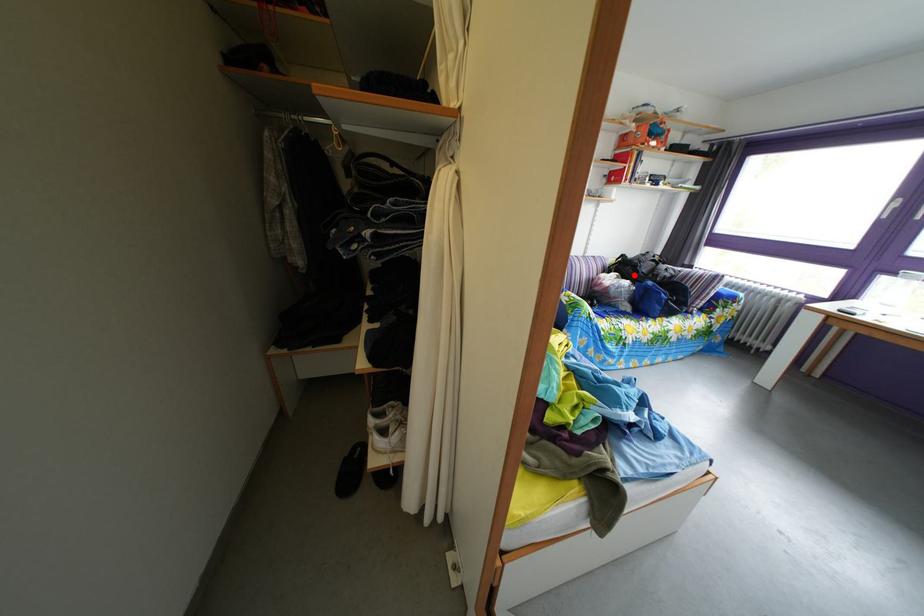
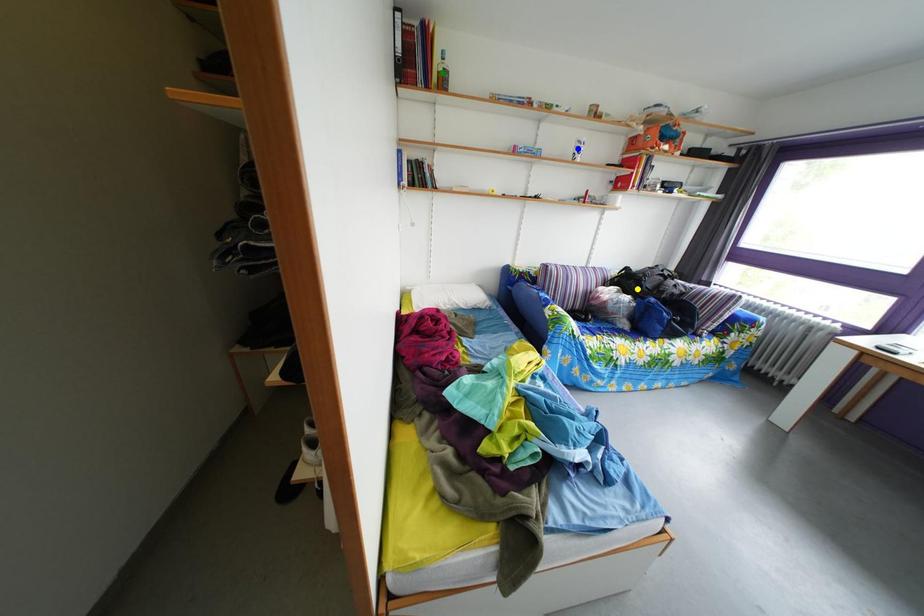
Question: I am providing you with two images of the same scene from different viewpoints. A red point is marked on the first image. You are given multiple points on the second image. In image 2, which mark is for the same physical point as the one in image 1?

Choices:
 (A) green point
 (B) yellow point
 (C) blue point

Answer: (B)